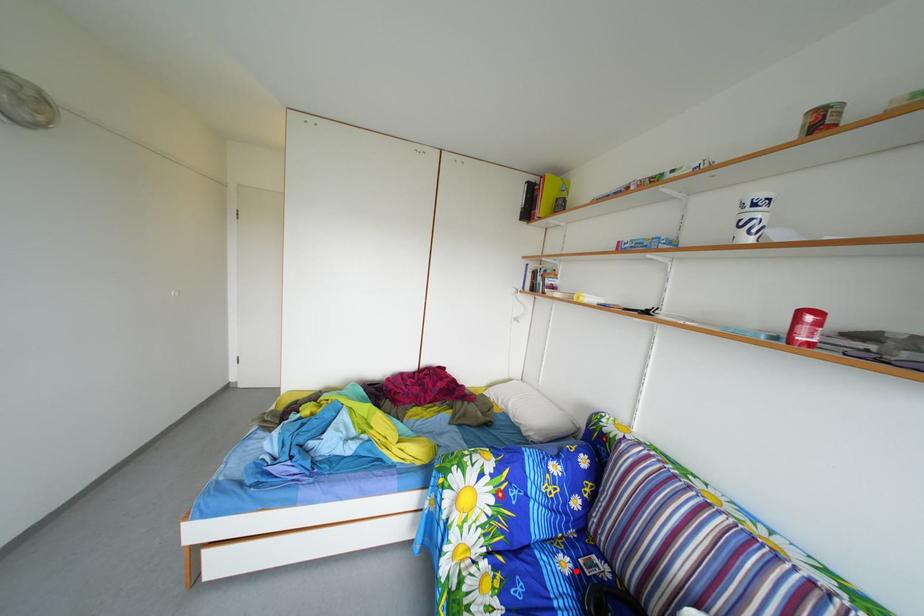
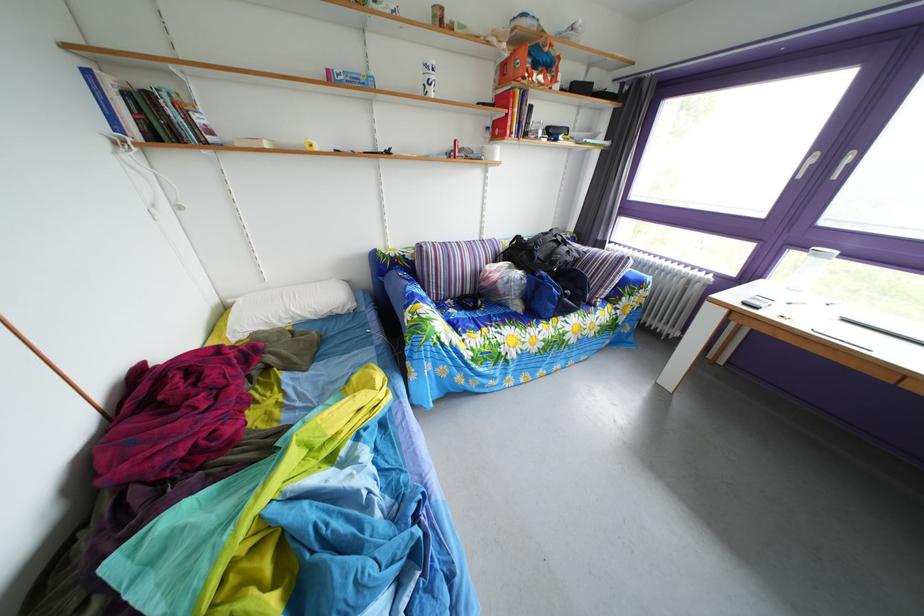
Where in the second image is the point corresponding to the highlighted location from the first image?

(463, 320)